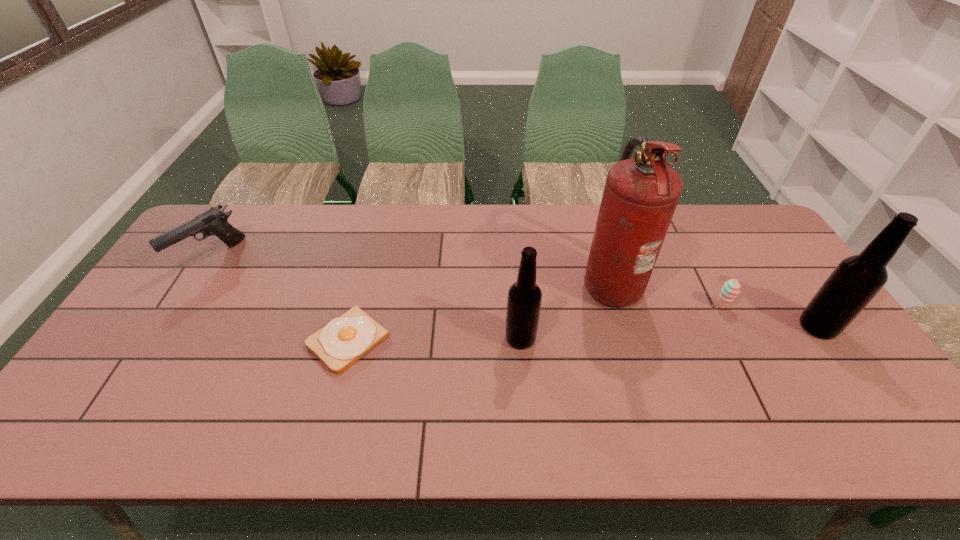
This screenshot has width=960, height=540. What are the coordinates of `object that is at the far edge` in the screenshot? It's located at (212, 222).

You are a GUI agent. You are given a task and a screenshot of the screen. Output one action in this format:
    pyautogui.click(x=<x>, y=<y>)
    Task: Click on the object at the near edge
    The height and width of the screenshot is (540, 960).
    Given the screenshot: What is the action you would take?
    click(x=344, y=340)

Locate an element on the screen. Image resolution: width=960 pixels, height=540 pixels. object that is at the left edge is located at coordinates pyautogui.click(x=212, y=222).

You are a GUI agent. You are given a task and a screenshot of the screen. Output one action in this format:
    pyautogui.click(x=<x>, y=<y>)
    Task: Click on the object present at the right edge
    The image size is (960, 540).
    Given the screenshot: What is the action you would take?
    pyautogui.click(x=857, y=279)

At what (x,y) coordinates should I click in order to perform the action: click on object that is positioned at the far left corner. Please return your answer as a coordinate pair (x, y). Looking at the image, I should click on (212, 222).

Find the location of a particular element. This screenshot has width=960, height=540. vacant space at the far edge is located at coordinates (314, 231).

You are a GUI agent. You are given a task and a screenshot of the screen. Output one action in this format:
    pyautogui.click(x=<x>, y=<y>)
    Task: Click on the free space at the near edge of the desktop
    The width and height of the screenshot is (960, 540).
    Given the screenshot: What is the action you would take?
    pyautogui.click(x=179, y=400)

The height and width of the screenshot is (540, 960). In order to click on vacant space at the right edge of the desktop in this screenshot , I will do `click(799, 362)`.

Locate an element on the screen. Image resolution: width=960 pixels, height=540 pixels. blank region between the shortest object and the rightmost object is located at coordinates (583, 334).

Image resolution: width=960 pixels, height=540 pixels. What are the coordinates of `free space between the fourth object from left to right and the second shortest object` in the screenshot? It's located at (665, 294).